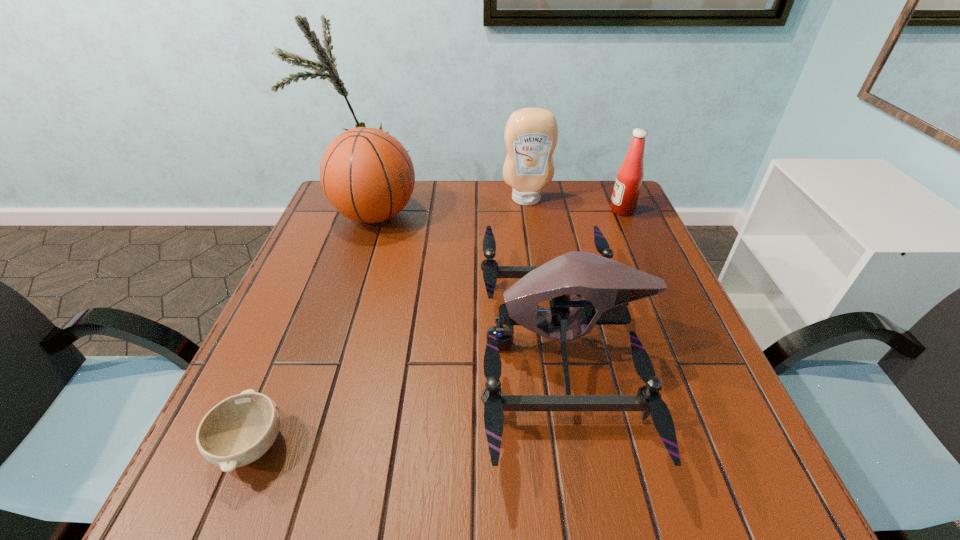
Find the location of a particular element. This screenshot has height=540, width=960. vacant space situated on the front-facing side of the drone is located at coordinates (324, 345).

In order to click on vacant space located on the front-facing side of the drone in this screenshot , I will do `click(400, 345)`.

Find the location of a particular element. The height and width of the screenshot is (540, 960). blank space located on the front-facing side of the drone is located at coordinates (371, 345).

The image size is (960, 540). Find the location of `vacant space located 0.360m on the back of the bowl`. vacant space located 0.360m on the back of the bowl is located at coordinates (323, 274).

Where is `basketball located in the far edge section of the desktop`? This screenshot has width=960, height=540. basketball located in the far edge section of the desktop is located at coordinates (368, 176).

Locate an element on the screen. The height and width of the screenshot is (540, 960). drone positioned at the near edge is located at coordinates (608, 286).

I want to click on bowl that is at the near edge, so click(x=237, y=431).

This screenshot has width=960, height=540. I want to click on basketball located in the left edge section of the desktop, so click(368, 176).

The width and height of the screenshot is (960, 540). What are the coordinates of `bowl present at the left edge` in the screenshot? It's located at (237, 431).

Identify the location of condiment present at the right edge. The height and width of the screenshot is (540, 960). tap(629, 178).